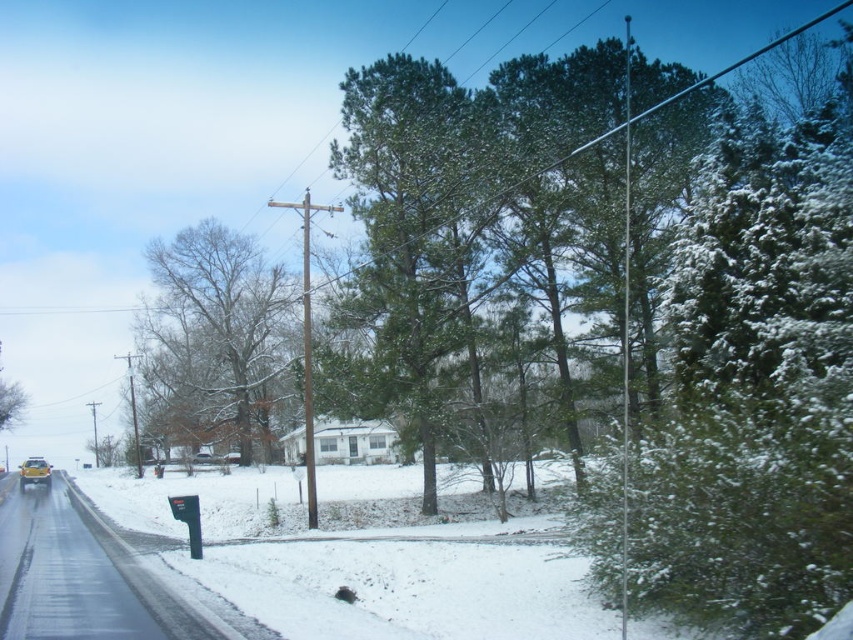
Who is higher up, bare branches tree at center or yellow matte car at lower left?

bare branches tree at center is above.

Is bare branches tree at center wider than yellow matte car at lower left?

Result: Yes.

Looking at this image, who is more forward, (171,403) or (32,477)?

Point (32,477)

In order to click on bare branches tree at center in this screenshot , I will do `click(213, 337)`.

Does green needle-like at center appear on the right side of yellow matte car at lower left?

Correct, you'll find green needle-like at center to the right of yellow matte car at lower left.

Locate an element on the screen. Image resolution: width=853 pixels, height=640 pixels. green needle-like at center is located at coordinates (448, 209).

Identify the location of green needle-like at center. (448, 209).

What are the coordinates of `green needle-like at center` in the screenshot? It's located at (448, 209).

Between point (434, 333) and point (270, 273), which one is positioned in front?

Positioned in front is point (434, 333).

Between green needle-like at center and bare branches tree at center, which one appears on the right side from the viewer's perspective?

green needle-like at center is more to the right.

You are a GUI agent. You are given a task and a screenshot of the screen. Output one action in this format:
    pyautogui.click(x=<x>, y=<y>)
    Task: Click on the green needle-like at center
    This screenshot has width=853, height=640.
    Given the screenshot: What is the action you would take?
    pyautogui.click(x=448, y=209)